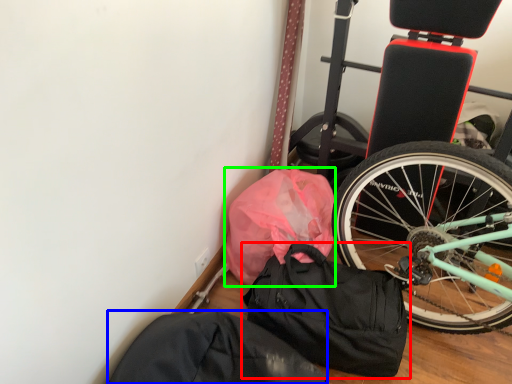
Question: Which object is the closest to the luggage and bags (highlighted by a red box)? Choose among these: sack (highlighted by a blue box) or material (highlighted by a green box).

Choices:
 (A) sack
 (B) material

Answer: (B)